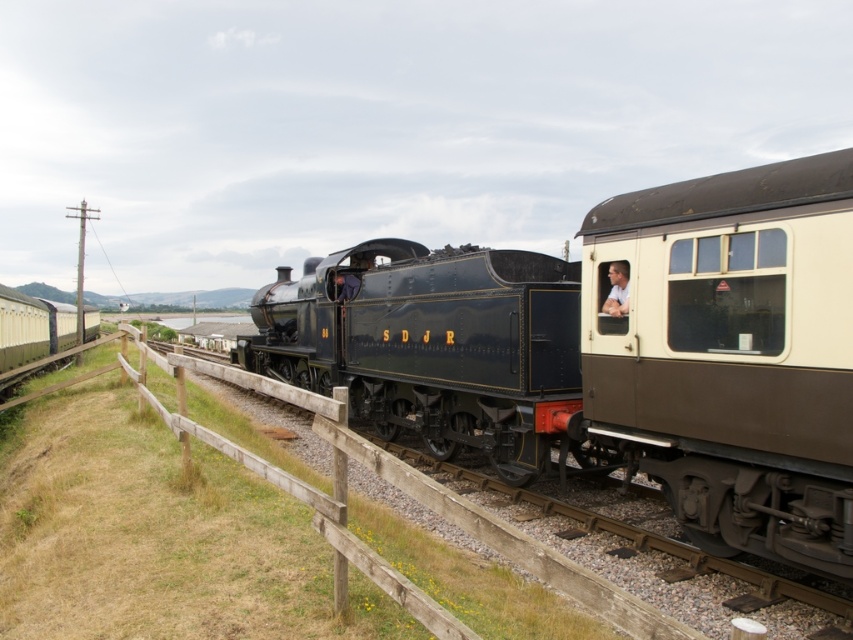
You are standing at the center of the railway station and want to take a photo of the polished dark blue locomotive at center. According to the scene description, where should you position yourself relative to the locomotive to capture it in the frame?

The polished dark blue locomotive at center is located at point [622,349] in the 2D space. To capture it in your photo, position yourself directly in front of it, ensuring the center of your frame aligns with its coordinates.

You are a railway engineer assessing the space between two locomotives at a station. The locomotives are the polished dark blue locomotive at center and the matte black locomotive at center. Which locomotive requires more space when parked side by side with another train?

The polished dark blue locomotive at center requires more space when parked side by side with another train because its width surpasses that of the matte black locomotive at center.

You are standing at the railway station and want to take a photo of the matte cream passenger car at right and the light blue shirt at center. Which object should you focus on first to ensure both are in the frame?

You should focus on the matte cream passenger car at right first because it is closer to you than the light blue shirt at center, so it will be in the foreground and both can be captured in the frame.